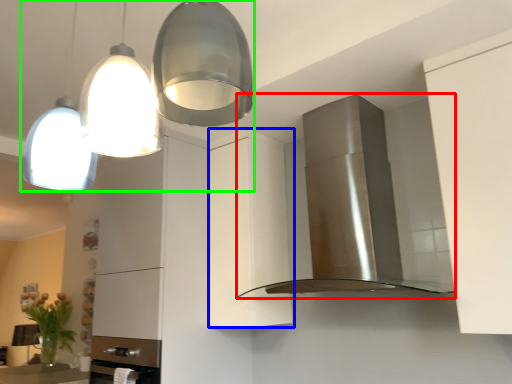
Question: Which object is the farthest from home appliance (highlighted by a red box)? Choose among these: cabinetry (highlighted by a blue box) or light fixture (highlighted by a green box).

Choices:
 (A) cabinetry
 (B) light fixture

Answer: (B)